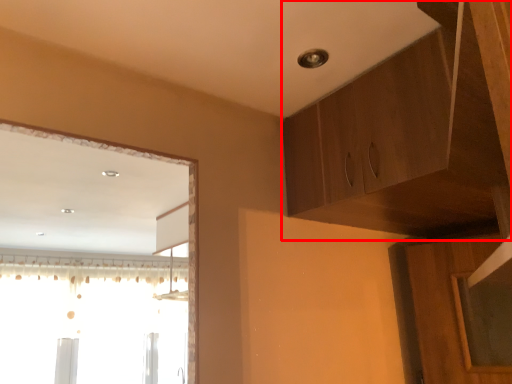
Question: In this image, where is cabinetry (annotated by the red box) located relative to window?

Choices:
 (A) left
 (B) right

Answer: (B)